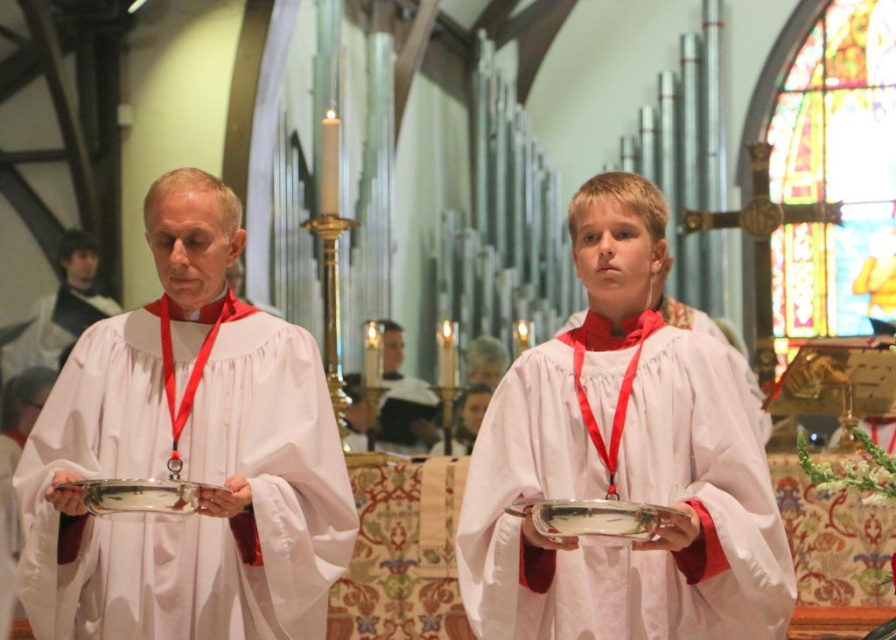
You are an attendee at the church service and need to approach the person in the white cotton robe at left to ask a question. Which direction should you move from the smooth white robe at center to reach them?

You should move to the left from the smooth white robe at center to reach the white cotton robe at left since the white cotton robe at left is positioned to the left of smooth white robe at center.

You are an attendee at the church service. You notice two robes worn by the participants. The white matte robe at center and the white cotton robe at left. Which robe is positioned lower in the image?

The white matte robe at center is positioned lower in the image as it is described to be below the white cotton robe at left.